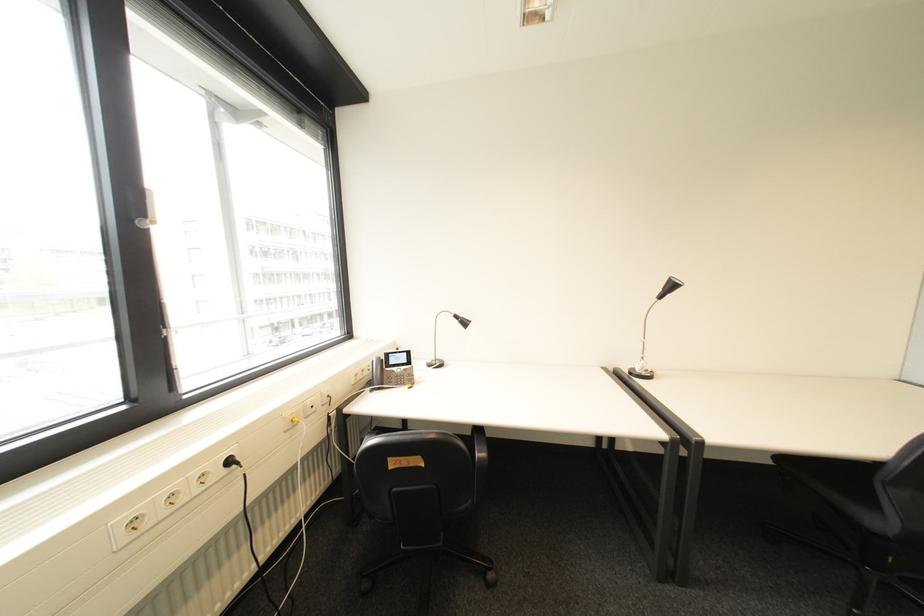
Find where to push the black power plug. Please return your answer as a coordinate pair (x, y).

(232, 461)